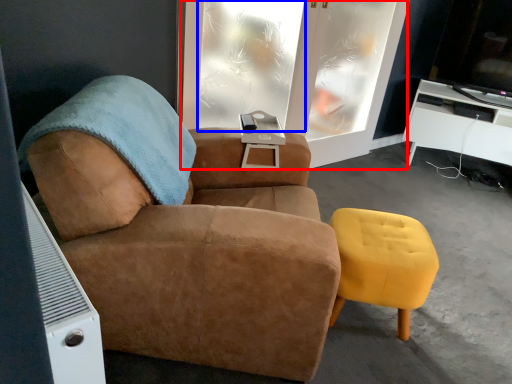
Question: Which object appears farthest to the camera in this image, screen door (highlighted by a red box) or window (highlighted by a blue box)?

Choices:
 (A) screen door
 (B) window

Answer: (A)